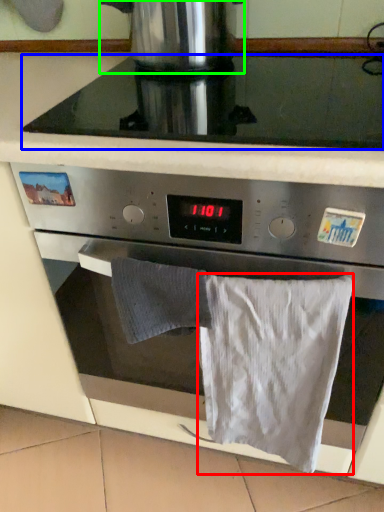
Question: Considering the real-world distances, which object is closest to bath towel (highlighted by a red box)? gas stove (highlighted by a blue box) or kitchen appliance (highlighted by a green box).

Choices:
 (A) gas stove
 (B) kitchen appliance

Answer: (A)